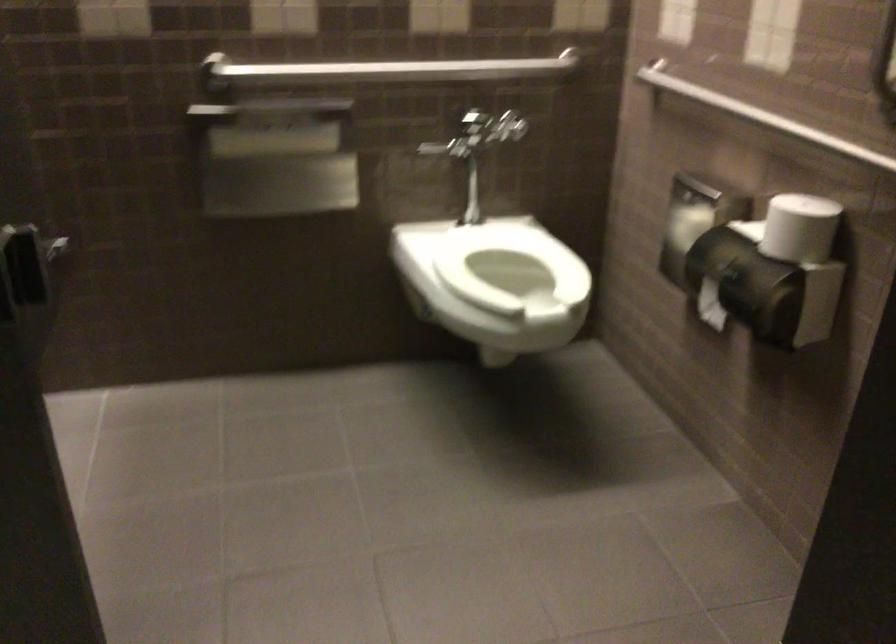
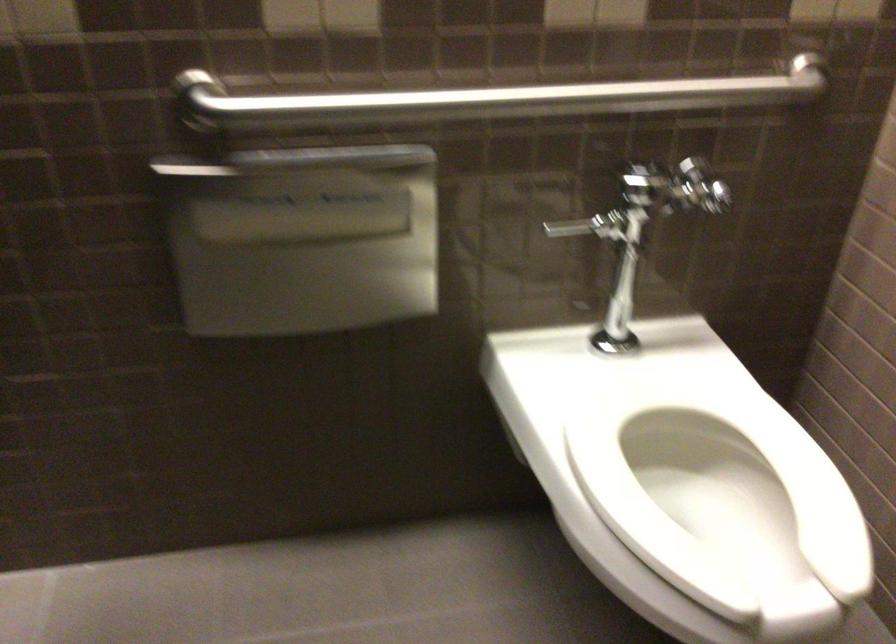
Where in the second image is the point corresponding to [449,149] from the first image?

(589, 225)